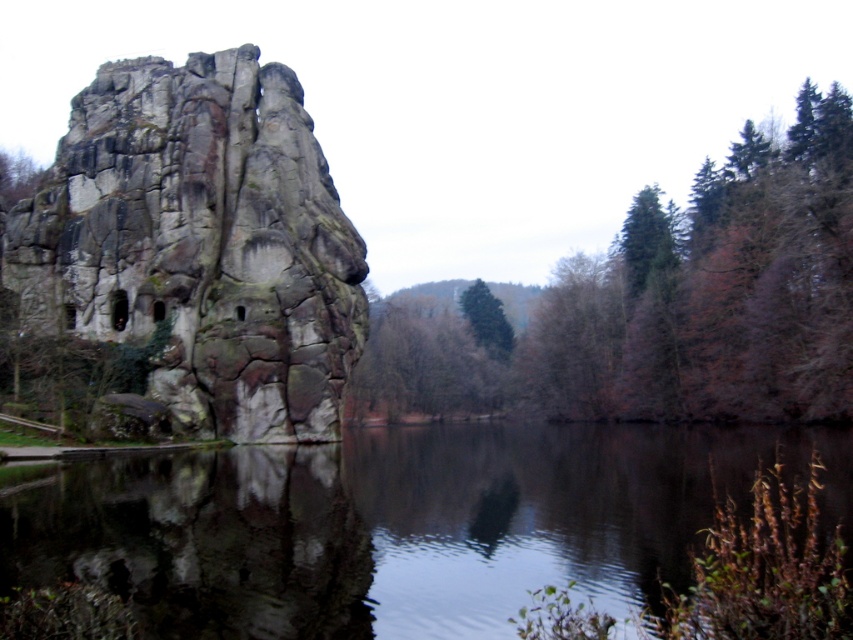
Question: Does smooth brown tree at right appear on the left side of green textured tree at center?

Choices:
 (A) yes
 (B) no

Answer: (B)

Question: Considering the relative positions of dark reflective water at center and green textured tree at center in the image provided, where is dark reflective water at center located with respect to green textured tree at center?

Choices:
 (A) left
 (B) right

Answer: (A)

Question: Which of the following is the farthest from the observer?

Choices:
 (A) (178, 429)
 (B) (480, 340)

Answer: (B)

Question: Which point is closer to the camera?

Choices:
 (A) (x=262, y=196)
 (B) (x=488, y=353)
 (C) (x=604, y=529)

Answer: (C)

Question: Where is rough stone rock formation at left located in relation to green textured tree at center in the image?

Choices:
 (A) below
 (B) above

Answer: (B)

Question: Which point appears farthest from the camera in this image?

Choices:
 (A) (148, 624)
 (B) (222, 314)
 (C) (476, 394)

Answer: (C)